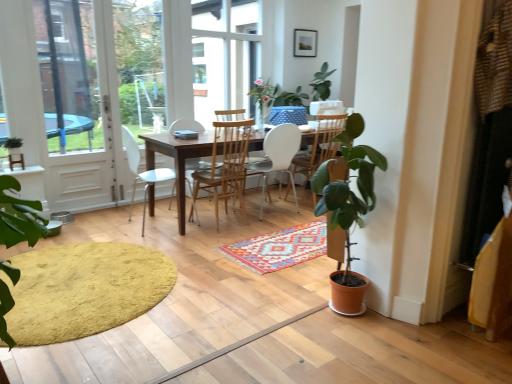
Question: Is multicolored woven rug at center, the 1th doormat viewed from the right, not within matte black picture frame at upper center?

Choices:
 (A) no
 (B) yes

Answer: (B)

Question: Is multicolored woven rug at center, the 2th doormat when ordered from left to right, aimed at matte black picture frame at upper center?

Choices:
 (A) no
 (B) yes

Answer: (A)

Question: Is matte black picture frame at upper center located within multicolored woven rug at center, the 2th doormat when ordered from left to right?

Choices:
 (A) yes
 (B) no

Answer: (B)

Question: Is multicolored woven rug at center, the 1th doormat viewed from the right, positioned in front of matte black picture frame at upper center?

Choices:
 (A) no
 (B) yes

Answer: (B)

Question: From a real-world perspective, is multicolored woven rug at center, the 1th doormat viewed from the right, positioned under matte black picture frame at upper center based on gravity?

Choices:
 (A) yes
 (B) no

Answer: (A)

Question: Is multicolored woven rug at center, the 2th doormat when ordered from left to right, at the right side of matte black picture frame at upper center?

Choices:
 (A) yes
 (B) no

Answer: (B)

Question: Is wooden table at center far away from green matte plant at left?

Choices:
 (A) yes
 (B) no

Answer: (A)

Question: Is wooden table at center shorter than green matte plant at left?

Choices:
 (A) yes
 (B) no

Answer: (B)

Question: Considering the relative sizes of wooden table at center and green matte plant at left in the image provided, is wooden table at center smaller than green matte plant at left?

Choices:
 (A) yes
 (B) no

Answer: (B)

Question: Does wooden table at center appear on the right side of green matte plant at left?

Choices:
 (A) no
 (B) yes

Answer: (B)

Question: Is green matte plant at left surrounded by wooden table at center?

Choices:
 (A) yes
 (B) no

Answer: (B)

Question: Is wooden table at center taller than green matte plant at left?

Choices:
 (A) no
 (B) yes

Answer: (B)

Question: Is white plastic chair at center, the first chair viewed from the left, located outside white glass door at left?

Choices:
 (A) yes
 (B) no

Answer: (A)